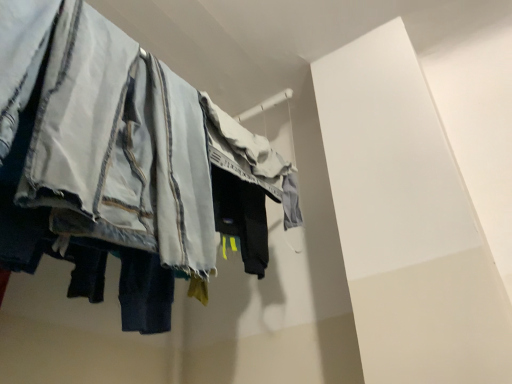
The width and height of the screenshot is (512, 384). Describe the element at coordinates (122, 163) in the screenshot. I see `denim pants at left` at that location.

Image resolution: width=512 pixels, height=384 pixels. What are the coordinates of `denim pants at left` in the screenshot? It's located at (122, 163).

The height and width of the screenshot is (384, 512). What are the coordinates of `denim pants at left` in the screenshot? It's located at (122, 163).